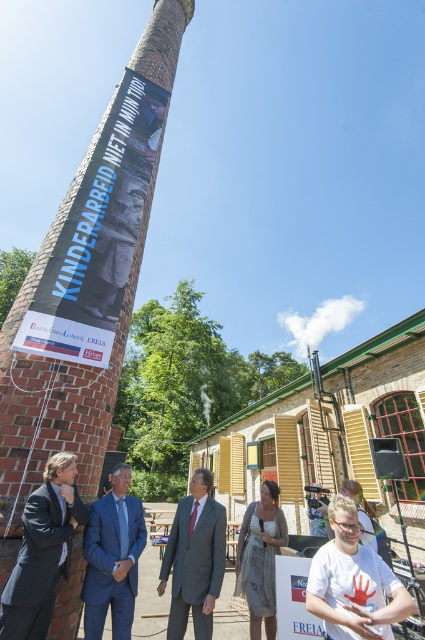
You are a fashion designer observing a photoshoot setup with a matte gray suit at center and a dark gray wool suit at lower left. Which suit is closer to the camera?

The matte gray suit at center is closer to the camera since the dark gray wool suit at lower left is behind it.